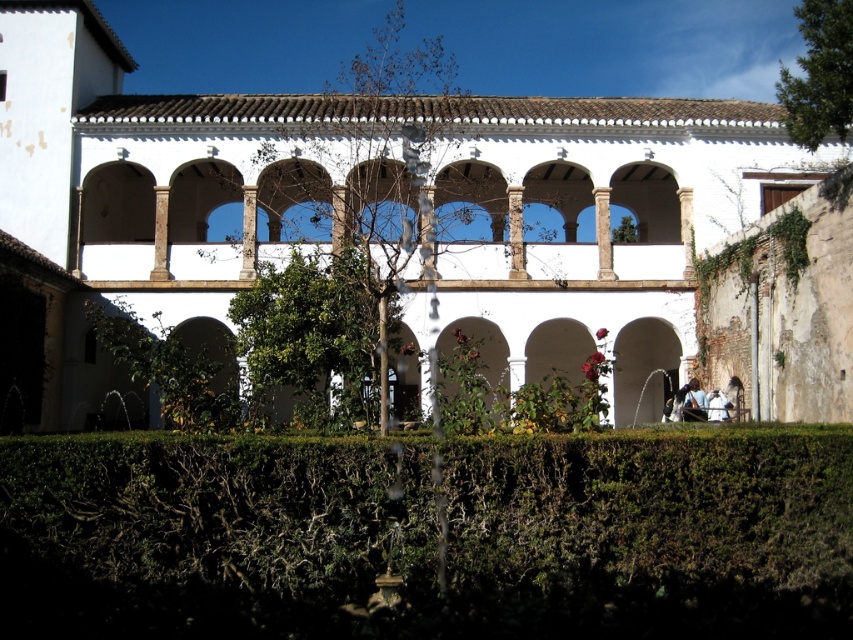
Can you confirm if white stone building at center is wider than green stone archway at lower left?

Yes, white stone building at center is wider than green stone archway at lower left.

Can you confirm if white stone building at center is thinner than green stone archway at lower left?

No.

Who is more forward, (74,387) or (201,365)?

Point (201,365) is more forward.

The width and height of the screenshot is (853, 640). What are the coordinates of `white stone building at center` in the screenshot? It's located at (424, 211).

Is white stone building at center taller than green leafy hedge at lower center?

Indeed, white stone building at center has a greater height compared to green leafy hedge at lower center.

Who is lower down, white stone building at center or green leafy hedge at lower center?

green leafy hedge at lower center

Describe the element at coordinates (424, 211) in the screenshot. I see `white stone building at center` at that location.

At what (x,y) coordinates should I click in order to perform the action: click on white stone building at center. Please return your answer as a coordinate pair (x, y). This screenshot has width=853, height=640. Looking at the image, I should click on (424, 211).

Is green stone archway at lower left to the right of green stone archway at center from the viewer's perspective?

Incorrect, green stone archway at lower left is not on the right side of green stone archway at center.

This screenshot has height=640, width=853. Describe the element at coordinates (198, 376) in the screenshot. I see `green stone archway at lower left` at that location.

At what (x,y) coordinates should I click in order to perform the action: click on green stone archway at lower left. Please return your answer as a coordinate pair (x, y). The height and width of the screenshot is (640, 853). Looking at the image, I should click on (198, 376).

Locate an element on the screen. The width and height of the screenshot is (853, 640). green stone archway at lower left is located at coordinates (198, 376).